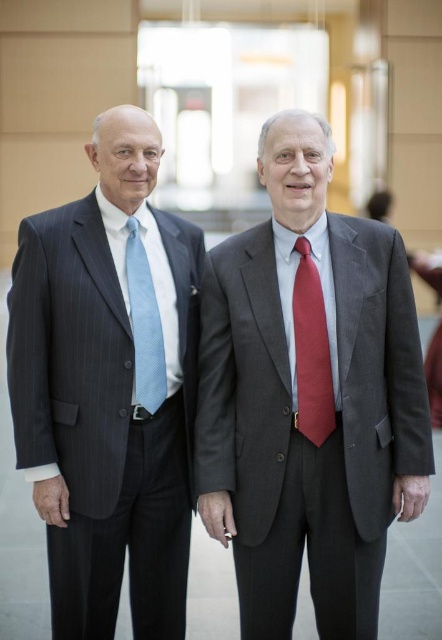
Question: From the image, what is the correct spatial relationship of gray pinstripe suit at center in relation to light blue textured tie at left?

Choices:
 (A) above
 (B) below

Answer: (B)

Question: Which of these objects is positioned closest to the pinstriped suit at left?

Choices:
 (A) gray pinstripe suit at center
 (B) matte red tie at center

Answer: (A)

Question: Is pinstriped suit at left behind matte red tie at center?

Choices:
 (A) no
 (B) yes

Answer: (B)

Question: Which point is closer to the camera?

Choices:
 (A) (167, 611)
 (B) (204, 445)

Answer: (B)

Question: Which object is the closest to the pinstriped suit at left?

Choices:
 (A) gray pinstripe suit at center
 (B) matte red tie at center
 (C) light blue textured tie at left

Answer: (C)

Question: Observing the image, what is the correct spatial positioning of matte red tie at center in reference to light blue textured tie at left?

Choices:
 (A) left
 (B) right

Answer: (B)